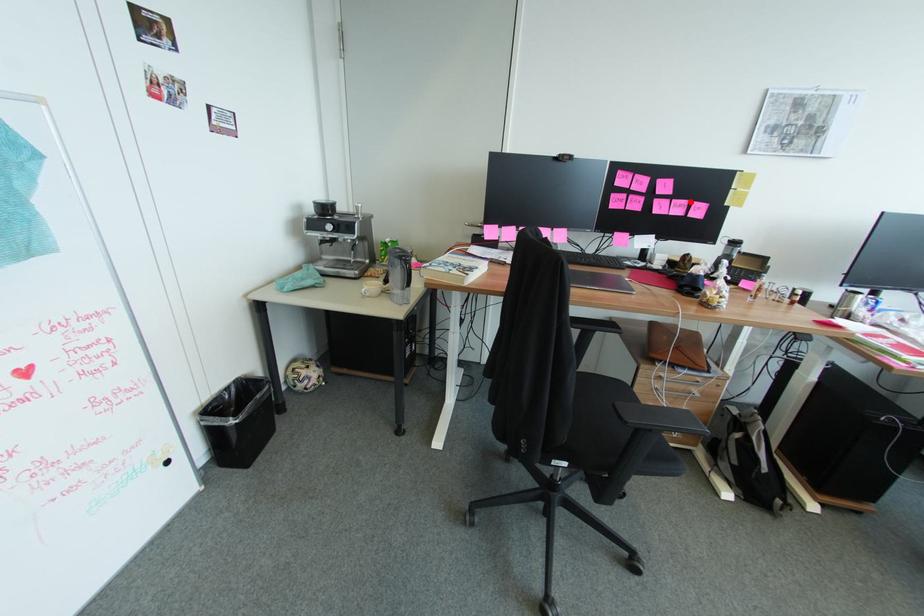
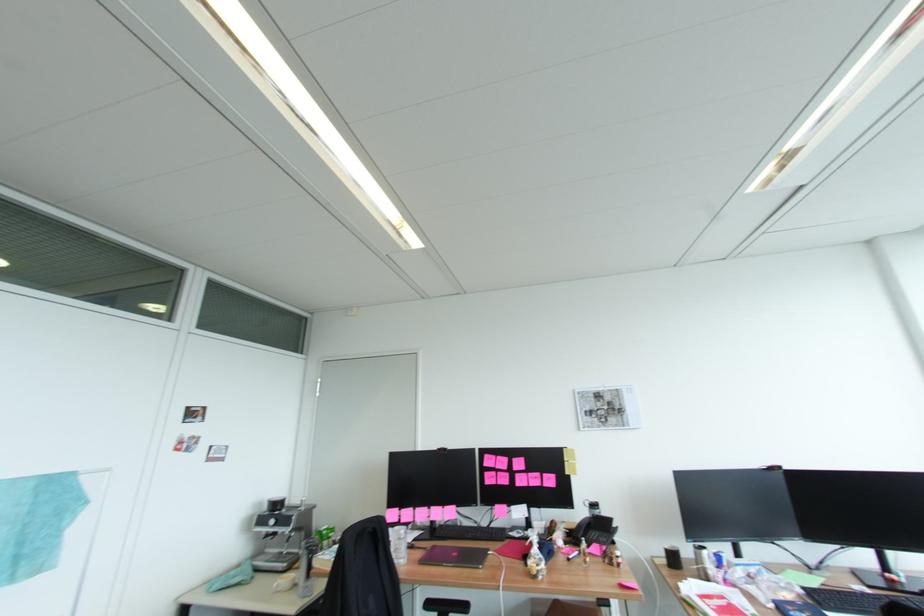
Question: I am providing you with two images of the same scene from different viewpoints. In image1, a red point is highlighted. Considering the same 3D point in image2, which of the following is correct?

Choices:
 (A) It is closer
 (B) It is farther

Answer: (B)